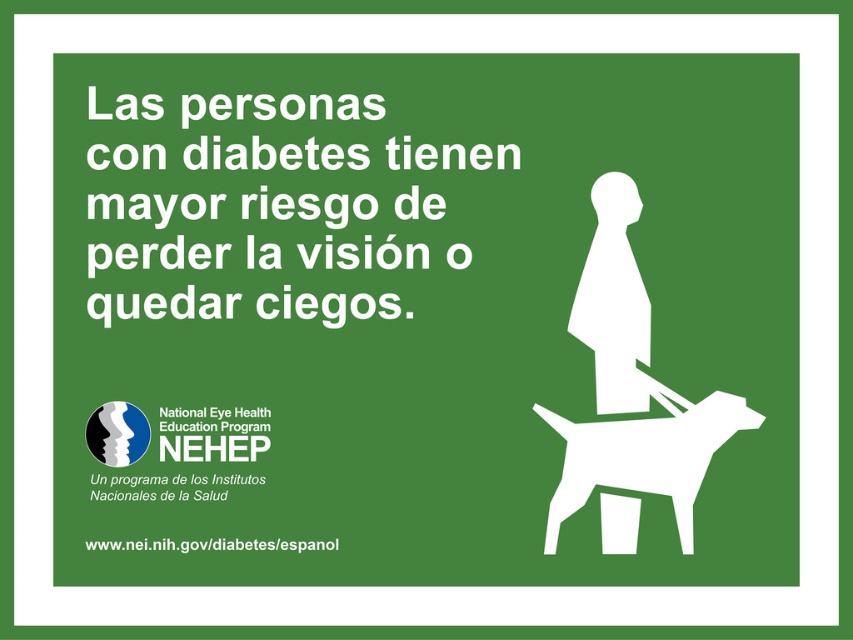
Is the position of white matte dog at lower right more distant than that of white matte silhouette at center?

No, white matte dog at lower right is in front of white matte silhouette at center.

Between point (639, 433) and point (608, 188), which one is positioned in front?

Point (639, 433) is in front.

The width and height of the screenshot is (853, 640). Identify the location of white matte dog at lower right. (643, 456).

Locate an element on the screen. The image size is (853, 640). white matte dog at lower right is located at coordinates (643, 456).